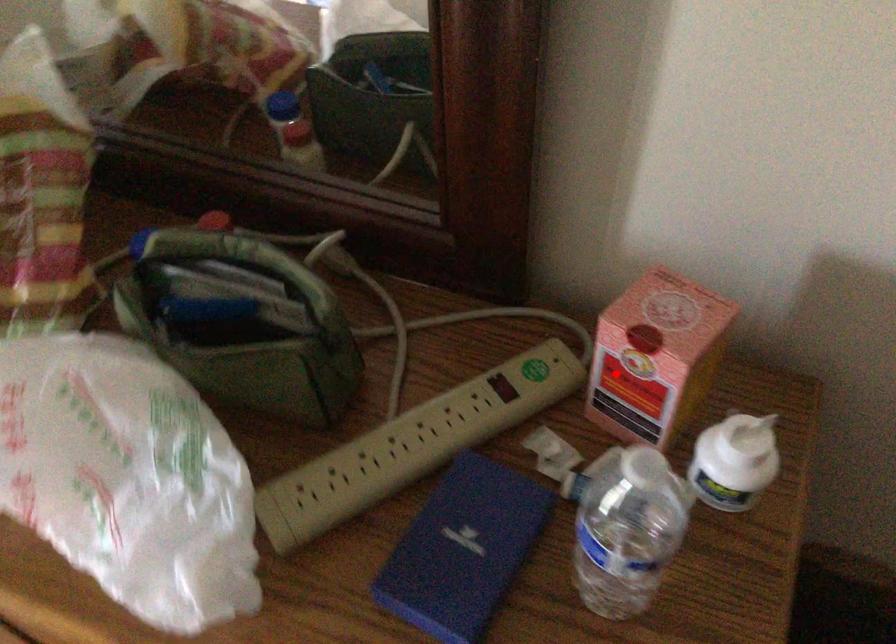
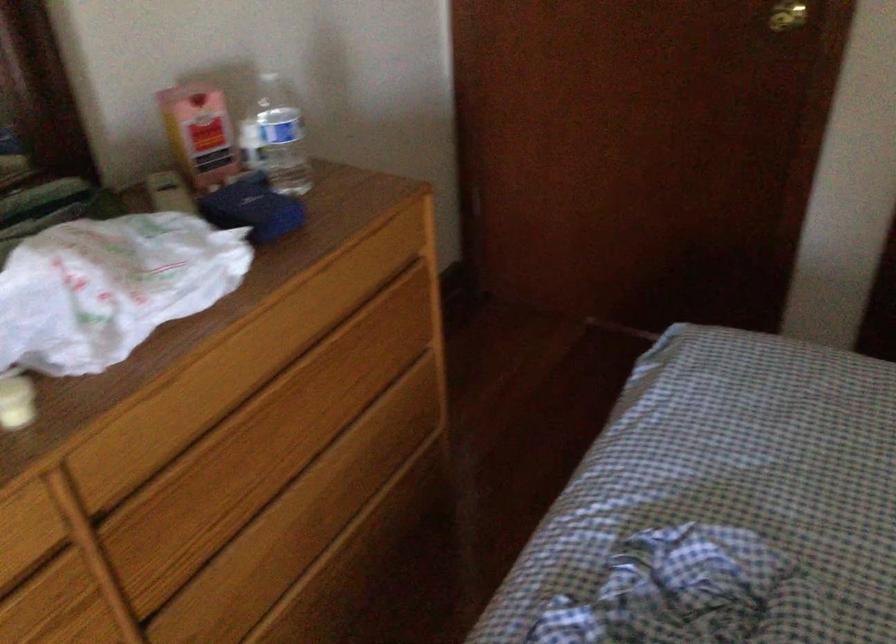
Question: I am providing you with two images of the same scene from different viewpoints. In image1, a red point is highlighted. Considering the same 3D point in image2, which of the following is correct?

Choices:
 (A) It is closer
 (B) It is farther

Answer: (B)